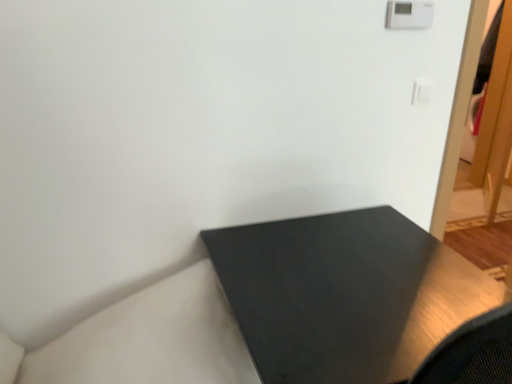
Question: Is matte black table at lower left in front of or behind white plastic light switch at upper right in the image?

Choices:
 (A) behind
 (B) front

Answer: (B)

Question: In the image, is matte black table at lower left on the left side or the right side of white plastic light switch at upper right?

Choices:
 (A) right
 (B) left

Answer: (B)

Question: Considering the positions of matte black table at lower left and white plastic light switch at upper right in the image, is matte black table at lower left taller or shorter than white plastic light switch at upper right?

Choices:
 (A) tall
 (B) short

Answer: (A)

Question: From a real-world perspective, is white plastic light switch at upper right above or below matte black table at lower left?

Choices:
 (A) above
 (B) below

Answer: (A)

Question: Is white plastic light switch at upper right in front of or behind matte black table at lower left in the image?

Choices:
 (A) behind
 (B) front

Answer: (A)

Question: Is white plastic light switch at upper right to the left or to the right of matte black table at lower left in the image?

Choices:
 (A) left
 (B) right

Answer: (B)

Question: From the image's perspective, is white plastic light switch at upper right above or below matte black table at lower left?

Choices:
 (A) below
 (B) above

Answer: (B)